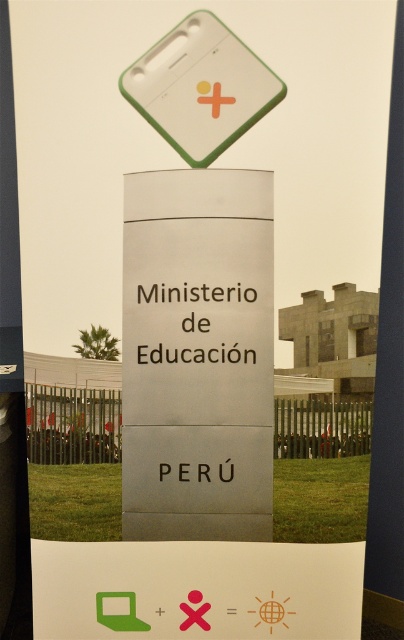
Who is positioned more to the left, white plastic sign at upper center or white smooth pole at right?

white plastic sign at upper center is more to the left.

Does white plastic sign at upper center appear over white smooth pole at right?

Yes.

What do you see at coordinates (201, 88) in the screenshot? This screenshot has height=640, width=404. I see `white plastic sign at upper center` at bounding box center [201, 88].

Where is `white plastic sign at upper center`? The width and height of the screenshot is (404, 640). white plastic sign at upper center is located at coordinates (201, 88).